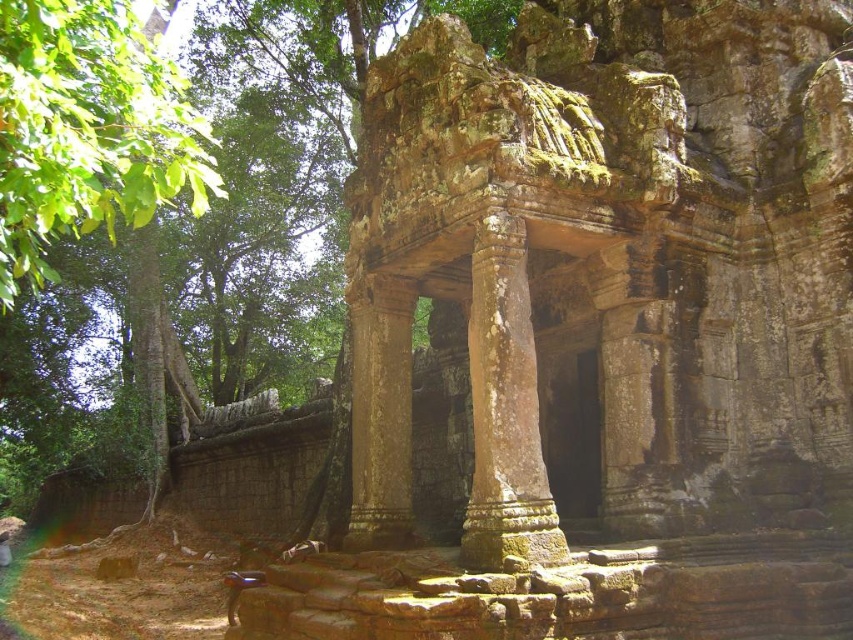
You are an archaeologist examining the ancient stone structure. You notice the brown stone temple at center and the rusty stone pillar at center. Which of these two objects is wider?

The brown stone temple at center is wider than the rusty stone pillar at center.

You are an archaeologist examining the brown stone temple at center and the green leafy tree at left. Which object has a narrower width?

The brown stone temple at center is thinner than the green leafy tree at left, so the brown stone temple at center has a narrower width.